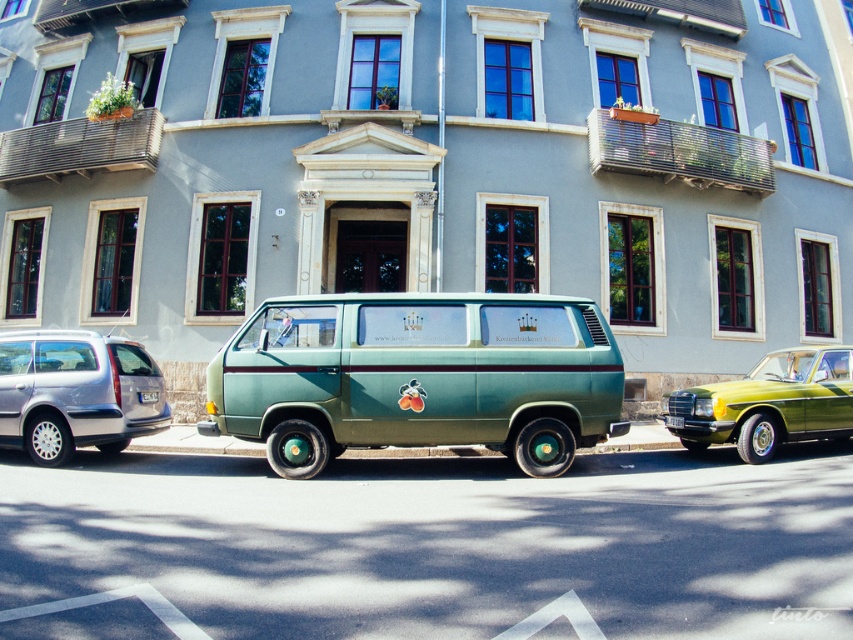
Describe the element at coordinates (418, 376) in the screenshot. I see `green matte van at center` at that location.

Is point (265, 408) less distant than point (808, 426)?

That is True.

Which is behind, point (558, 404) or point (828, 371)?

The point (828, 371) is behind.

Where is `green matte van at center`? green matte van at center is located at coordinates (418, 376).

Between metallic green sedan at right and green matte license plate at center, which one is positioned lower?

metallic green sedan at right is below.

Who is positioned more to the left, metallic green sedan at right or green matte license plate at center?

Positioned to the left is green matte license plate at center.

Who is more forward, [807,369] or [157,396]?

Positioned in front is point [157,396].

This screenshot has height=640, width=853. In order to click on metallic green sedan at right in this screenshot , I will do `click(769, 403)`.

Find the location of a particular element. satin silver minivan at left is located at coordinates (74, 392).

Measure the distance from satin silver minivan at left to green matte license plate at center.

A distance of 31.49 inches exists between satin silver minivan at left and green matte license plate at center.

At what (x,y) coordinates should I click in order to perform the action: click on satin silver minivan at left. Please return your answer as a coordinate pair (x, y). The width and height of the screenshot is (853, 640). Looking at the image, I should click on (74, 392).